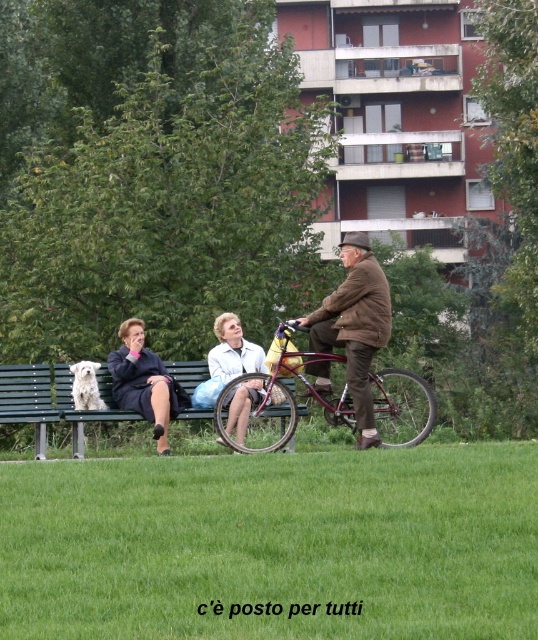
Between brown leather jacket at center and green wooden bench at left, which one appears on the right side from the viewer's perspective?

brown leather jacket at center is more to the right.

Which is above, brown leather jacket at center or green wooden bench at left?

Positioned higher is brown leather jacket at center.

Is point (350, 234) farther from viewer compared to point (52, 397)?

Yes, point (350, 234) is behind point (52, 397).

This screenshot has height=640, width=538. I want to click on brown leather jacket at center, so click(x=355, y=324).

Can you confirm if light blue fabric dress at center is shorter than white fluffy dog at left?

No, light blue fabric dress at center is not shorter than white fluffy dog at left.

At what (x,y) coordinates should I click in order to perform the action: click on light blue fabric dress at center. Please return your answer as a coordinate pair (x, y). Looking at the image, I should click on (233, 349).

Does brown leather jacket at center have a greater width compared to white fluffy dog at left?

Yes.

Who is more distant from viewer, (365,298) or (102,400)?

Positioned behind is point (102,400).

Who is more distant from viewer, (370, 362) or (81, 384)?

The point (81, 384) is behind.

Find the location of `brown leather jacket at center`. brown leather jacket at center is located at coordinates (355, 324).